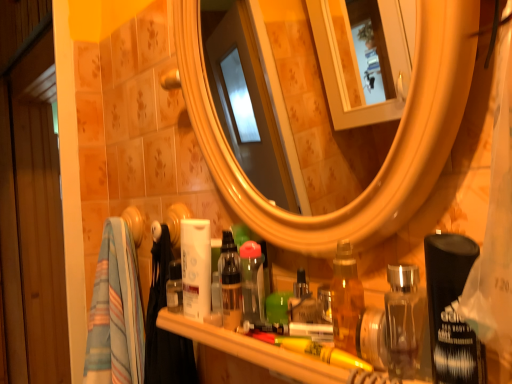
Question: Is green plastic brush at center, which is the 1th toiletry in right-to-left order, smaller than translucent plastic bottle at center, which appears as the third toiletry when viewed from the right?

Choices:
 (A) yes
 (B) no

Answer: (A)

Question: Is green plastic brush at center, the third toiletry positioned from the left, thinner than translucent plastic bottle at center, arranged as the 1th toiletry when viewed from the left?

Choices:
 (A) yes
 (B) no

Answer: (B)

Question: Is green plastic brush at center, the third toiletry positioned from the left, far from translucent plastic bottle at center, which appears as the third toiletry when viewed from the right?

Choices:
 (A) no
 (B) yes

Answer: (A)

Question: Does green plastic brush at center, the third toiletry positioned from the left, appear on the left side of translucent plastic bottle at center, arranged as the 1th toiletry when viewed from the left?

Choices:
 (A) no
 (B) yes

Answer: (A)

Question: Is green plastic brush at center, the third toiletry positioned from the left, turned away from translucent plastic bottle at center, which appears as the third toiletry when viewed from the right?

Choices:
 (A) no
 (B) yes

Answer: (A)

Question: Is green plastic brush at center, which is the 1th toiletry in right-to-left order, located outside translucent plastic bottle at center, which appears as the third toiletry when viewed from the right?

Choices:
 (A) yes
 (B) no

Answer: (A)

Question: Can you confirm if green plastic brush at center, the third toiletry positioned from the left, is positioned to the right of translucent plastic items at lower center?

Choices:
 (A) no
 (B) yes

Answer: (A)

Question: Considering the relative sizes of green plastic brush at center, which is the 1th toiletry in right-to-left order, and translucent plastic items at lower center in the image provided, is green plastic brush at center, which is the 1th toiletry in right-to-left order, wider than translucent plastic items at lower center?

Choices:
 (A) yes
 (B) no

Answer: (B)

Question: Is green plastic brush at center, the third toiletry positioned from the left, far away from translucent plastic items at lower center?

Choices:
 (A) yes
 (B) no

Answer: (B)

Question: Considering the relative sizes of green plastic brush at center, which is the 1th toiletry in right-to-left order, and translucent plastic items at lower center in the image provided, is green plastic brush at center, which is the 1th toiletry in right-to-left order, smaller than translucent plastic items at lower center?

Choices:
 (A) no
 (B) yes

Answer: (B)

Question: Would you say green plastic brush at center, the third toiletry positioned from the left, contains translucent plastic items at lower center?

Choices:
 (A) no
 (B) yes

Answer: (A)

Question: From the image's perspective, is green plastic brush at center, which is the 1th toiletry in right-to-left order, on translucent plastic items at lower center?

Choices:
 (A) yes
 (B) no

Answer: (A)

Question: From the image's perspective, is translucent plastic bottle at center, which appears as the third toiletry when viewed from the right, above translucent plastic items at lower center?

Choices:
 (A) no
 (B) yes

Answer: (B)